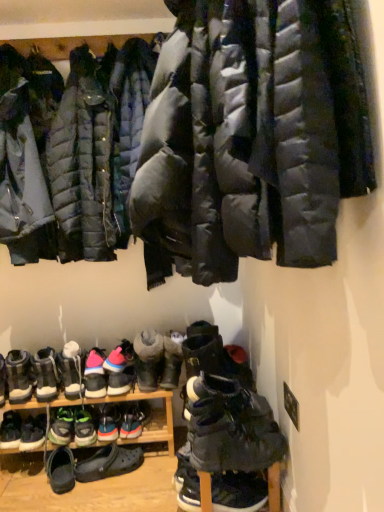
Question: Does multicolored fabric sneaker at lower left, which appears as the 10th footwear when viewed from the right, come in front of matte black puffer jacket at upper left, acting as the 2th jacket starting from the front?

Choices:
 (A) no
 (B) yes

Answer: (A)

Question: Is multicolored fabric sneaker at lower left, which appears as the 10th footwear when viewed from the right, at the left side of matte black puffer jacket at upper left, acting as the 2th jacket starting from the front?

Choices:
 (A) yes
 (B) no

Answer: (A)

Question: Is multicolored fabric sneaker at lower left, the 6th footwear viewed from the left, further to camera compared to matte black puffer jacket at upper left, the second jacket positioned from the back?

Choices:
 (A) no
 (B) yes

Answer: (B)

Question: Is multicolored fabric sneaker at lower left, which appears as the 10th footwear when viewed from the right, thinner than matte black puffer jacket at upper left, acting as the 2th jacket starting from the front?

Choices:
 (A) yes
 (B) no

Answer: (A)

Question: Is multicolored fabric sneaker at lower left, the 6th footwear viewed from the left, far away from matte black puffer jacket at upper left, acting as the 2th jacket starting from the front?

Choices:
 (A) no
 (B) yes

Answer: (A)

Question: Is matte black puffer jacket at upper left, acting as the 2th jacket starting from the front, a part of multicolored fabric sneaker at lower left, which appears as the 10th footwear when viewed from the right?

Choices:
 (A) yes
 (B) no

Answer: (B)

Question: Considering the relative sizes of multicolored suede sneakers at center, the ninth footwear in the right-to-left sequence, and black suede boots at lower center, the thirteenth footwear in the left-to-right sequence, in the image provided, is multicolored suede sneakers at center, the ninth footwear in the right-to-left sequence, thinner than black suede boots at lower center, the thirteenth footwear in the left-to-right sequence,?

Choices:
 (A) no
 (B) yes

Answer: (B)

Question: From a real-world perspective, is multicolored suede sneakers at center, the ninth footwear in the right-to-left sequence, on black suede boots at lower center, arranged as the 3th footwear when viewed from the right?

Choices:
 (A) yes
 (B) no

Answer: (B)

Question: Can you confirm if multicolored suede sneakers at center, the ninth footwear in the right-to-left sequence, is positioned to the right of black suede boots at lower center, arranged as the 3th footwear when viewed from the right?

Choices:
 (A) yes
 (B) no

Answer: (B)

Question: Is multicolored suede sneakers at center, the ninth footwear in the right-to-left sequence, oriented away from black suede boots at lower center, the thirteenth footwear in the left-to-right sequence?

Choices:
 (A) yes
 (B) no

Answer: (B)

Question: Does multicolored suede sneakers at center, the seventh footwear in the left-to-right sequence, have a smaller size compared to black suede boots at lower center, the thirteenth footwear in the left-to-right sequence?

Choices:
 (A) yes
 (B) no

Answer: (A)

Question: Is multicolored suede sneakers at center, the ninth footwear in the right-to-left sequence, wider than black suede boots at lower center, arranged as the 3th footwear when viewed from the right?

Choices:
 (A) no
 (B) yes

Answer: (A)

Question: Can you confirm if dark gray suede boots at lower center, positioned as the first footwear in right-to-left order, is positioned to the left of matte black puffer jacket at upper left, acting as the 2th jacket starting from the front?

Choices:
 (A) yes
 (B) no

Answer: (B)